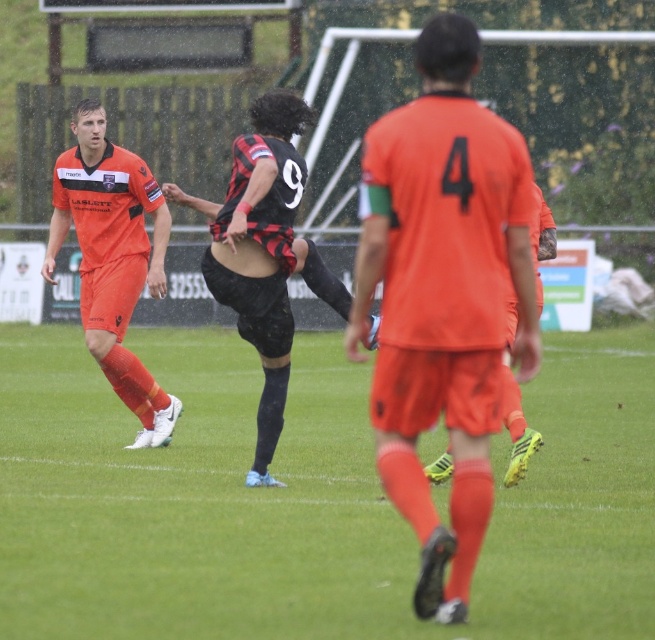
You are a soccer coach analyzing the field positions. The orange matte jersey at center is at coordinates 0.464, 0.676. Where would you instruct your player to move to intercept the ball if the ball is at position 0.5, 0.7?

The orange matte jersey at center is located at point (441, 296). Since the ball is at (458, 320), the player should move northeast to intercept the ball.

You are a soccer coach analyzing the team formation. The orange matte jersey at center and the matte orange uniform at left are both part of your team. How far apart are these two players from each other?

The orange matte jersey at center is 18.42 feet away from the matte orange uniform at left.